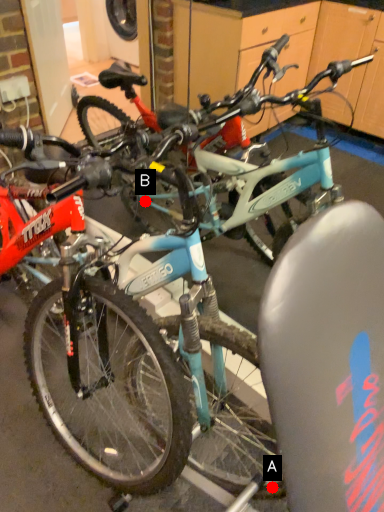
Question: Two points are circled on the image, labeled by A and B beside each circle. Which of the following is the closest to the observer?

Choices:
 (A) A is closer
 (B) B is closer

Answer: (A)